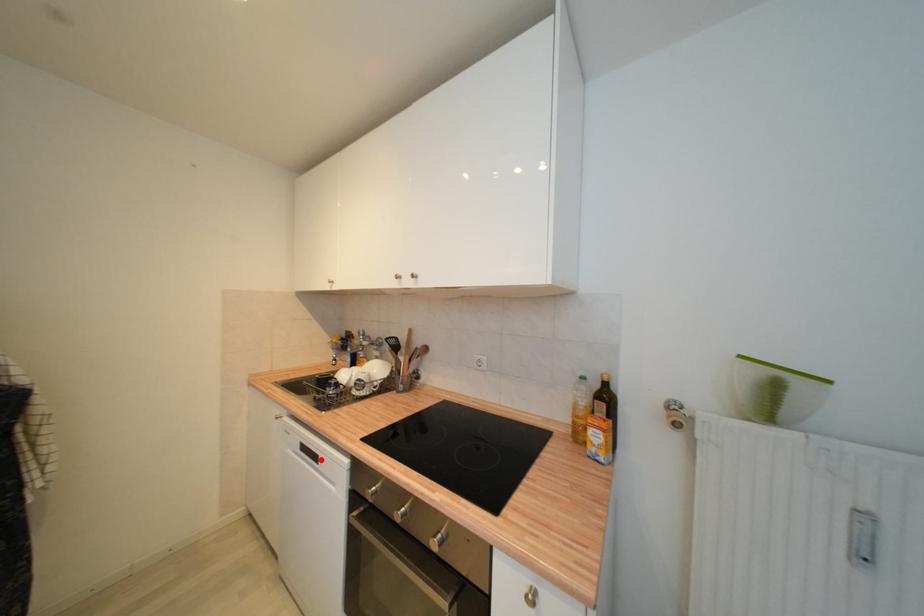
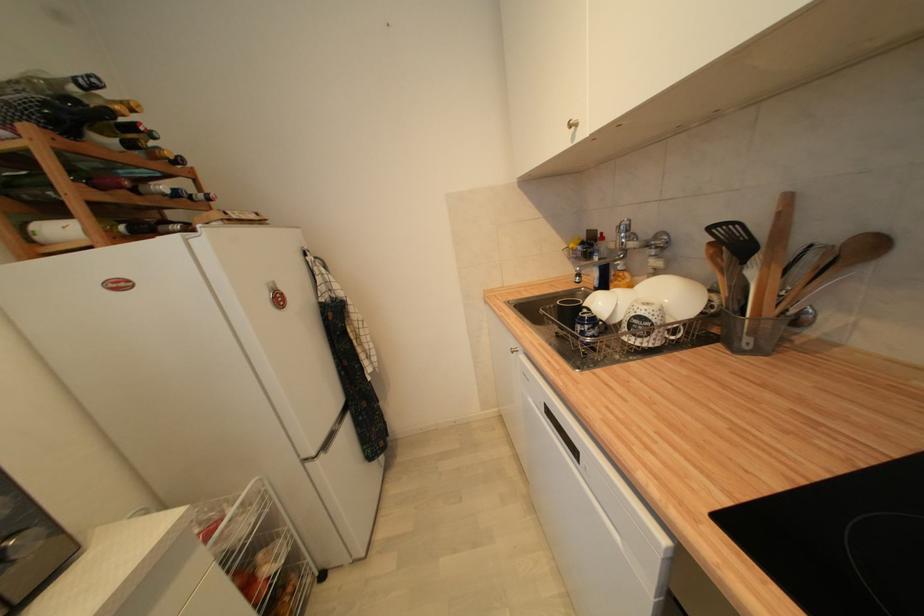
Find the pixel in the second image that matches the highlighted location in the first image.

(578, 453)